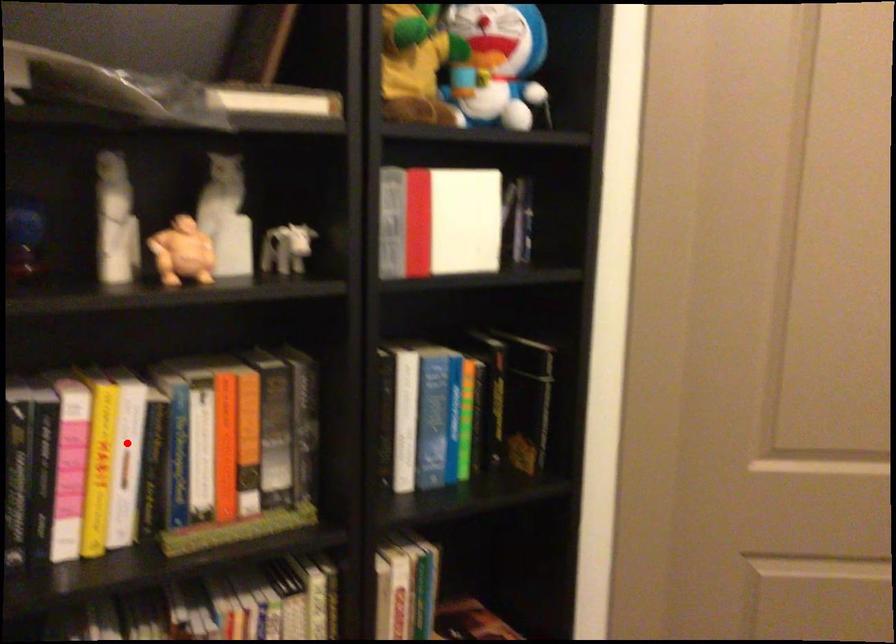
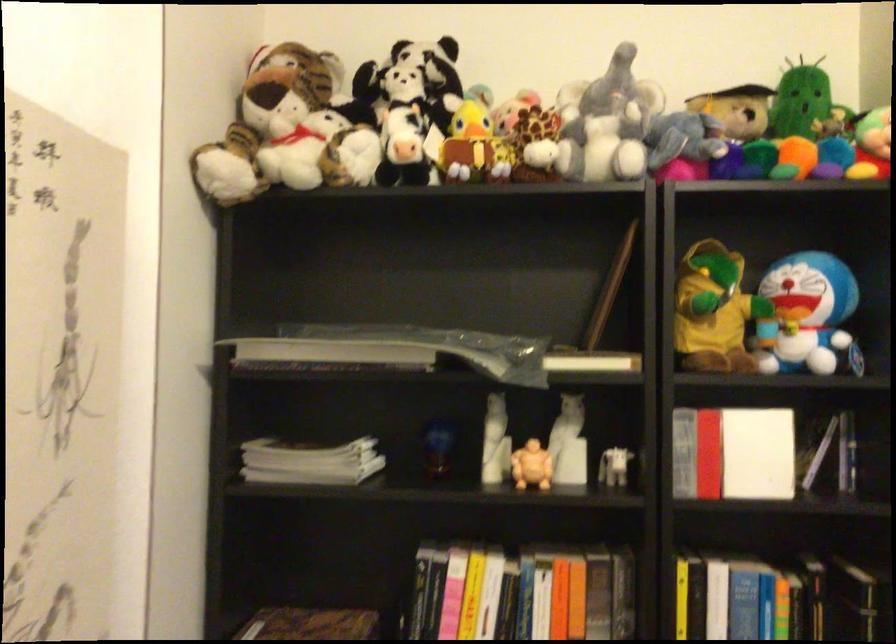
Question: I am providing you with two images of the same scene from different viewpoints. In image1, a red point is highlighted. Considering the same 3D point in image2, which of the following is correct?

Choices:
 (A) It is closer
 (B) It is farther

Answer: (B)